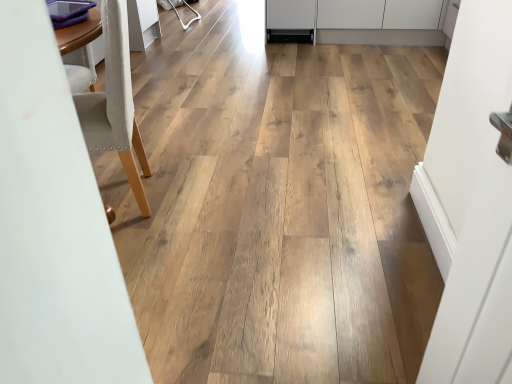
Identify the location of free region under white fabric chair at left (from a real-world perspective). tap(121, 197).